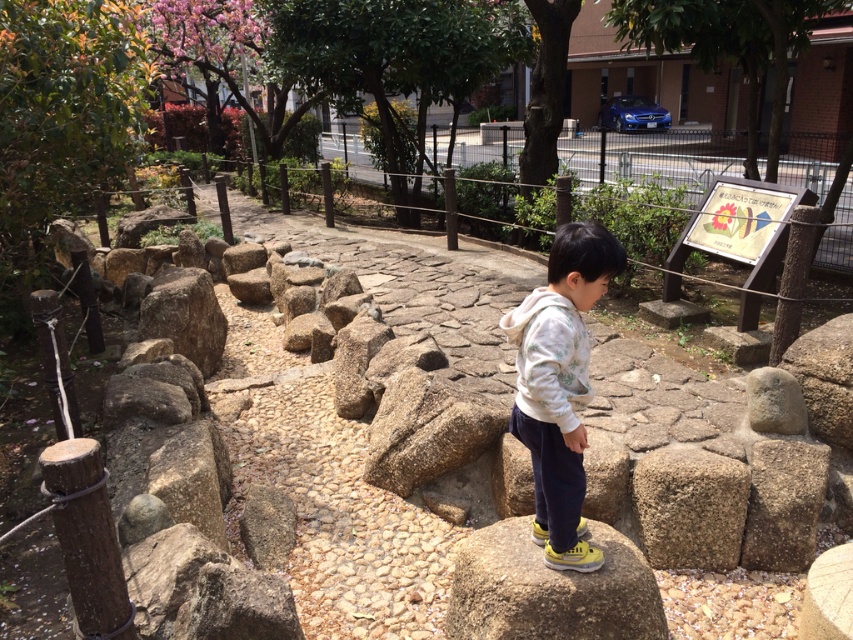
You are a photographer trying to capture the white fleece jacket at center and the brown rough stone at center in the same frame. Based on their positions, which object should you adjust your camera to focus on first if you want to include both in your shot?

The white fleece jacket at center is positioned on the left side of brown rough stone at center, so you should focus on the brown rough stone at center first to ensure both are in frame.

You are standing at the point labeled point [569,276] and want to walk towards the point labeled point [670,561]. Which direction should you move to get closer to your destination?

You should move away from the viewer because point [569,276] is closer to the viewer than point [670,561].

You are a hiker who wants to place your white fleece jacket at center on a rock that is exactly 33.53 inches away. Is the brown rough stone at center a suitable choice?

The white fleece jacket at center is 33.53 inches from the brown rough stone at center, so yes, the brown rough stone at center is exactly the right distance for placing the jacket.